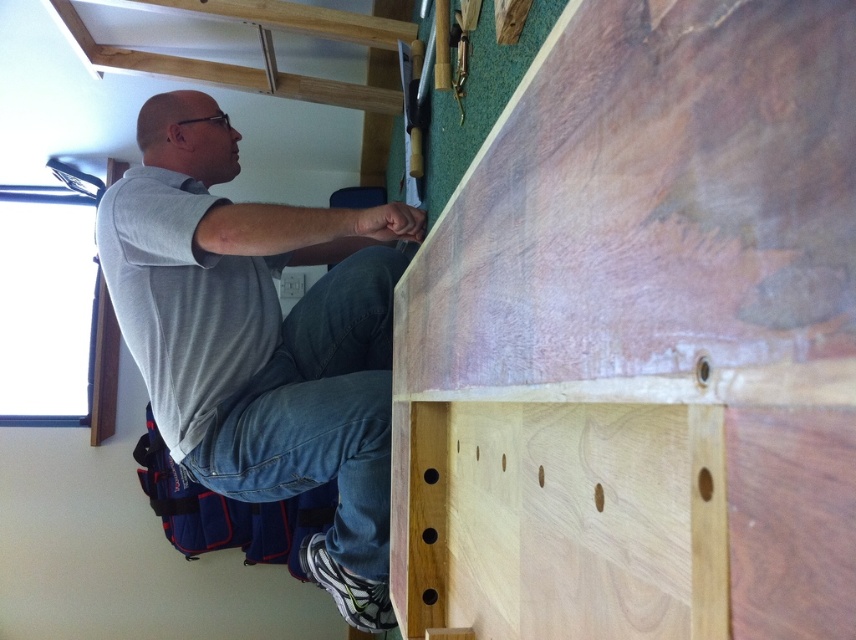
You are standing in front of the workbench and want to place a new tool on the natural wood plywood at center. Where exactly should you place it?

You should place the new tool at point (642, 340) on the natural wood plywood at center as specified.

You are standing in the workshop and see two points marked in the scene. Which point is closer to you, point (729, 20) or point (313, 435)?

Point (729, 20) is in front of point (313, 435), so it is closer to you.